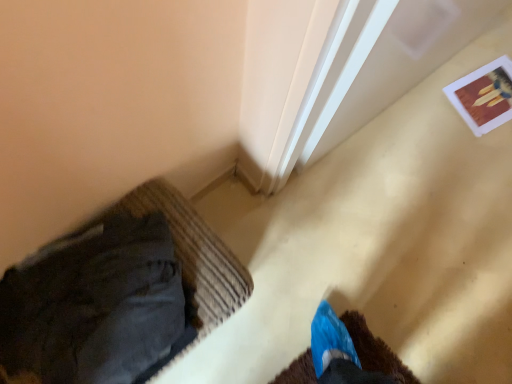
Describe the element at coordinates (192, 256) in the screenshot. This screenshot has height=384, width=512. I see `dark gray fabric at lower left` at that location.

Where is `dark gray fabric at lower left`? This screenshot has height=384, width=512. dark gray fabric at lower left is located at coordinates (192, 256).

The height and width of the screenshot is (384, 512). I want to click on dark gray fabric at lower left, so click(x=192, y=256).